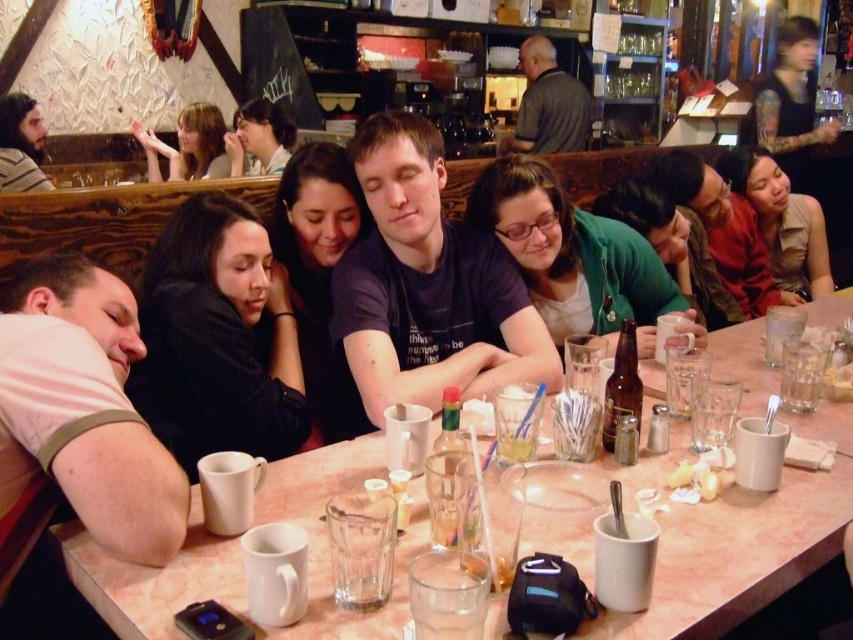
Which is above, gray fabric shirt at upper center or matte black hair at upper left?

gray fabric shirt at upper center

Does point (521, 42) lie behind point (132, 131)?

Yes.

Locate an element on the screen. gray fabric shirt at upper center is located at coordinates (547, 104).

Who is positioned more to the right, matte black shirt at center or bearded man at left?

Positioned to the right is matte black shirt at center.

Does matte black shirt at center have a greater height compared to bearded man at left?

No, matte black shirt at center is not taller than bearded man at left.

This screenshot has height=640, width=853. What do you see at coordinates (575, 257) in the screenshot? I see `matte black shirt at center` at bounding box center [575, 257].

In order to click on matte black shirt at center in this screenshot , I will do `click(575, 257)`.

Can you confirm if white ceramic mug at upper left is thinner than brown leather jacket at upper right?

No.

Does white ceramic mug at upper left have a smaller size compared to brown leather jacket at upper right?

Actually, white ceramic mug at upper left might be larger than brown leather jacket at upper right.

Between point (727, 355) and point (695, 186), which one is positioned behind?

Point (695, 186)

The height and width of the screenshot is (640, 853). Find the location of `white ceramic mug at upper left`. white ceramic mug at upper left is located at coordinates (744, 544).